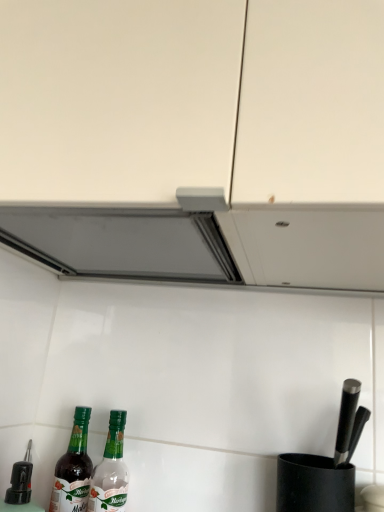
The image size is (384, 512). I want to click on green glass bottle at lower left, which is the first bottle in right-to-left order, so click(x=111, y=470).

What do you see at coordinates (111, 470) in the screenshot? I see `green glass bottle at lower left, which is the first bottle in right-to-left order` at bounding box center [111, 470].

The image size is (384, 512). What are the coordinates of `green glass bottle at lower left, the 2th bottle from the right` in the screenshot? It's located at (73, 469).

Measure the distance between green glass bottle at lower left, the 2th bottle from the right, and camera.

A distance of 27.55 inches exists between green glass bottle at lower left, the 2th bottle from the right, and camera.

What is the approximate height of green glass bottle at lower left, the 2th bottle from the right?

green glass bottle at lower left, the 2th bottle from the right, is 9.74 inches tall.

The height and width of the screenshot is (512, 384). What do you see at coordinates (73, 469) in the screenshot? I see `green glass bottle at lower left, marked as the first bottle in a left-to-right arrangement` at bounding box center [73, 469].

Where is `green glass bottle at lower left, which is the first bottle in right-to-left order`? Image resolution: width=384 pixels, height=512 pixels. green glass bottle at lower left, which is the first bottle in right-to-left order is located at coordinates (111, 470).

Considering the relative positions of green glass bottle at lower left, which appears as the second bottle when viewed from the left, and green glass bottle at lower left, the 2th bottle from the right, in the image provided, is green glass bottle at lower left, which appears as the second bottle when viewed from the left, to the right of green glass bottle at lower left, the 2th bottle from the right, from the viewer's perspective?

Yes.

Between green glass bottle at lower left, which appears as the second bottle when viewed from the left, and green glass bottle at lower left, marked as the first bottle in a left-to-right arrangement, which one is positioned in front?

green glass bottle at lower left, which appears as the second bottle when viewed from the left, is closer to the camera.

Considering the positions of point (118, 420) and point (85, 415), is point (118, 420) closer or farther from the camera than point (85, 415)?

Point (118, 420) is closer to the camera than point (85, 415).

From the image's perspective, relative to green glass bottle at lower left, the 2th bottle from the right, is green glass bottle at lower left, which appears as the second bottle when viewed from the left, above or below?

green glass bottle at lower left, which appears as the second bottle when viewed from the left, is below green glass bottle at lower left, the 2th bottle from the right.

From a real-world perspective, which is physically above, green glass bottle at lower left, which is the first bottle in right-to-left order, or green glass bottle at lower left, the 2th bottle from the right?

green glass bottle at lower left, which is the first bottle in right-to-left order, is physically above.

Considering the relative sizes of green glass bottle at lower left, which appears as the second bottle when viewed from the left, and green glass bottle at lower left, the 2th bottle from the right, in the image provided, is green glass bottle at lower left, which appears as the second bottle when viewed from the left, wider than green glass bottle at lower left, the 2th bottle from the right,?

No, green glass bottle at lower left, which appears as the second bottle when viewed from the left, is not wider than green glass bottle at lower left, the 2th bottle from the right.

Does green glass bottle at lower left, which is the first bottle in right-to-left order, have a greater height compared to green glass bottle at lower left, the 2th bottle from the right?

Result: Indeed, green glass bottle at lower left, which is the first bottle in right-to-left order, has a greater height compared to green glass bottle at lower left, the 2th bottle from the right.

Looking at the image, does green glass bottle at lower left, which is the first bottle in right-to-left order, seem bigger or smaller compared to green glass bottle at lower left, marked as the first bottle in a left-to-right arrangement?

Considering their sizes, green glass bottle at lower left, which is the first bottle in right-to-left order, takes up more space than green glass bottle at lower left, marked as the first bottle in a left-to-right arrangement.

Is green glass bottle at lower left, which appears as the second bottle when viewed from the left, located outside green glass bottle at lower left, the 2th bottle from the right?

Yes, green glass bottle at lower left, which appears as the second bottle when viewed from the left, is located beyond the bounds of green glass bottle at lower left, the 2th bottle from the right.

Does green glass bottle at lower left, which appears as the second bottle when viewed from the left, touch green glass bottle at lower left, the 2th bottle from the right?

Absolutely, green glass bottle at lower left, which appears as the second bottle when viewed from the left, is next to and touching green glass bottle at lower left, the 2th bottle from the right.

Could you tell me if green glass bottle at lower left, which appears as the second bottle when viewed from the left, is facing green glass bottle at lower left, the 2th bottle from the right?

No, green glass bottle at lower left, which appears as the second bottle when viewed from the left, is not oriented towards green glass bottle at lower left, the 2th bottle from the right.

How different are the orientations of green glass bottle at lower left, which appears as the second bottle when viewed from the left, and green glass bottle at lower left, marked as the first bottle in a left-to-right arrangement, in degrees?

green glass bottle at lower left, which appears as the second bottle when viewed from the left, and green glass bottle at lower left, marked as the first bottle in a left-to-right arrangement, are facing 0.000105 degrees away from each other.

How much distance is there between green glass bottle at lower left, which appears as the second bottle when viewed from the left, and green glass bottle at lower left, the 2th bottle from the right?

1.79 inches.

The width and height of the screenshot is (384, 512). In order to click on bottle above the green glass bottle at lower left, which appears as the second bottle when viewed from the left (from the image's perspective) in this screenshot , I will do `click(73, 469)`.

Is green glass bottle at lower left, the 2th bottle from the right, at the right side of green glass bottle at lower left, which is the first bottle in right-to-left order?

No, green glass bottle at lower left, the 2th bottle from the right, is not to the right of green glass bottle at lower left, which is the first bottle in right-to-left order.

Which object is closer to the camera, green glass bottle at lower left, marked as the first bottle in a left-to-right arrangement, or green glass bottle at lower left, which is the first bottle in right-to-left order?

green glass bottle at lower left, which is the first bottle in right-to-left order, is more forward.

Is point (73, 498) positioned after point (110, 478)?

No, (73, 498) is in front of (110, 478).

From the image's perspective, which object appears higher, green glass bottle at lower left, the 2th bottle from the right, or green glass bottle at lower left, which is the first bottle in right-to-left order?

green glass bottle at lower left, the 2th bottle from the right.

From a real-world perspective, which object stands above the other?

In real-world perspective, green glass bottle at lower left, which is the first bottle in right-to-left order, is above.

Which object is thinner, green glass bottle at lower left, marked as the first bottle in a left-to-right arrangement, or green glass bottle at lower left, which is the first bottle in right-to-left order?

With smaller width is green glass bottle at lower left, which is the first bottle in right-to-left order.

From the picture: Considering the sizes of objects green glass bottle at lower left, the 2th bottle from the right, and green glass bottle at lower left, which appears as the second bottle when viewed from the left, in the image provided, who is taller, green glass bottle at lower left, the 2th bottle from the right, or green glass bottle at lower left, which appears as the second bottle when viewed from the left,?

Standing taller between the two is green glass bottle at lower left, which appears as the second bottle when viewed from the left.

Based on their sizes in the image, would you say green glass bottle at lower left, the 2th bottle from the right, is bigger or smaller than green glass bottle at lower left, which is the first bottle in right-to-left order?

green glass bottle at lower left, the 2th bottle from the right, is smaller than green glass bottle at lower left, which is the first bottle in right-to-left order.

Can green glass bottle at lower left, which appears as the second bottle when viewed from the left, be found inside green glass bottle at lower left, the 2th bottle from the right?

No, green glass bottle at lower left, which appears as the second bottle when viewed from the left, is located outside of green glass bottle at lower left, the 2th bottle from the right.

Based on the photo, does green glass bottle at lower left, the 2th bottle from the right, touch green glass bottle at lower left, which is the first bottle in right-to-left order?

Yes, green glass bottle at lower left, the 2th bottle from the right, and green glass bottle at lower left, which is the first bottle in right-to-left order, clearly make contact.

Does green glass bottle at lower left, marked as the first bottle in a left-to-right arrangement, turn towards green glass bottle at lower left, which is the first bottle in right-to-left order?

No.

Looking at this image, how many degrees apart are the facing directions of green glass bottle at lower left, marked as the first bottle in a left-to-right arrangement, and green glass bottle at lower left, which is the first bottle in right-to-left order?

There is a 0.000105-degree angle between the facing directions of green glass bottle at lower left, marked as the first bottle in a left-to-right arrangement, and green glass bottle at lower left, which is the first bottle in right-to-left order.

How far apart are green glass bottle at lower left, the 2th bottle from the right, and green glass bottle at lower left, which is the first bottle in right-to-left order?

green glass bottle at lower left, the 2th bottle from the right, and green glass bottle at lower left, which is the first bottle in right-to-left order, are 1.79 inches apart from each other.

Locate an element on the screen. This screenshot has height=512, width=384. bottle behind the green glass bottle at lower left, which appears as the second bottle when viewed from the left is located at coordinates (73, 469).

The image size is (384, 512). What are the coordinates of `bottle on the left side of green glass bottle at lower left, which appears as the second bottle when viewed from the left` in the screenshot? It's located at pos(73,469).

Where is `bottle in front of the green glass bottle at lower left, the 2th bottle from the right`? The width and height of the screenshot is (384, 512). bottle in front of the green glass bottle at lower left, the 2th bottle from the right is located at coordinates (111, 470).